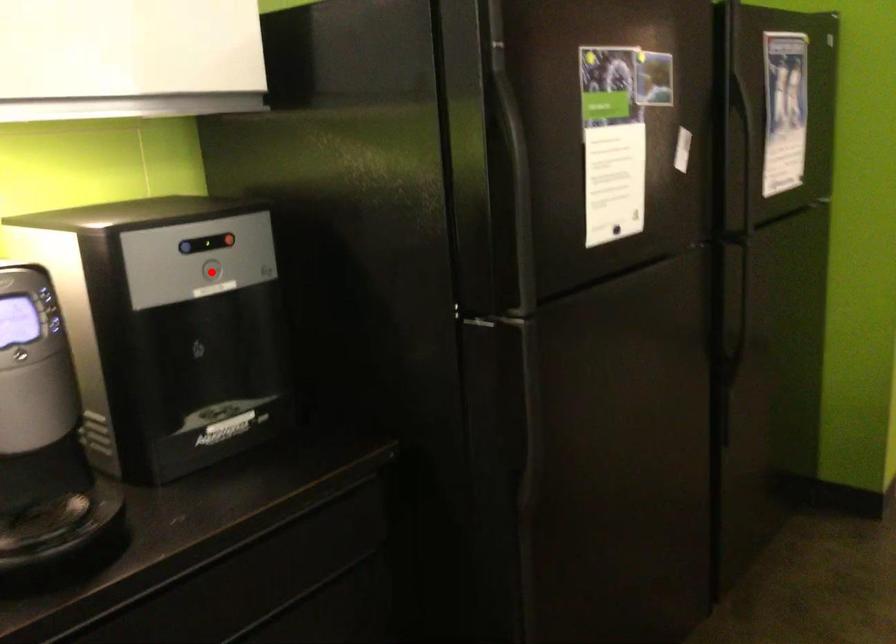
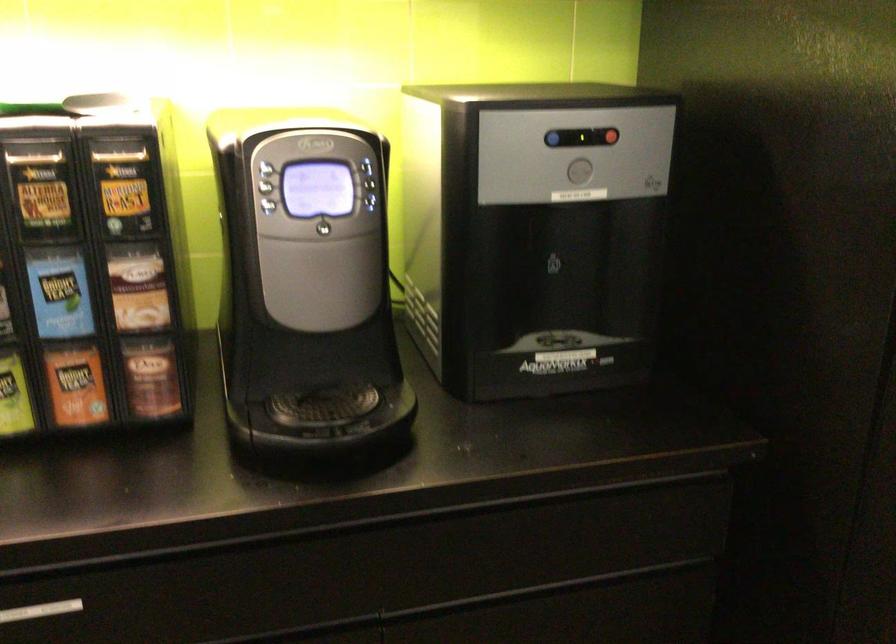
Find the pixel in the second image that matches the highlighted location in the first image.

(579, 172)